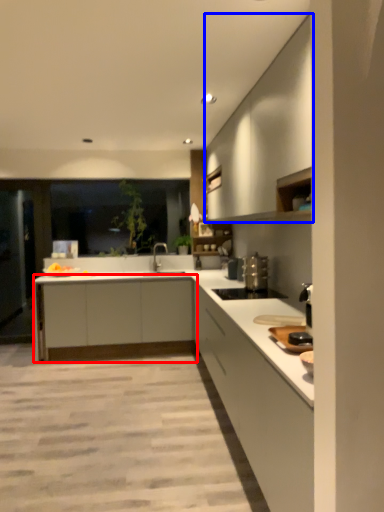
Question: Among these objects, which one is farthest to the camera, cabinetry (highlighted by a red box) or cabinetry (highlighted by a blue box)?

Choices:
 (A) cabinetry
 (B) cabinetry

Answer: (A)